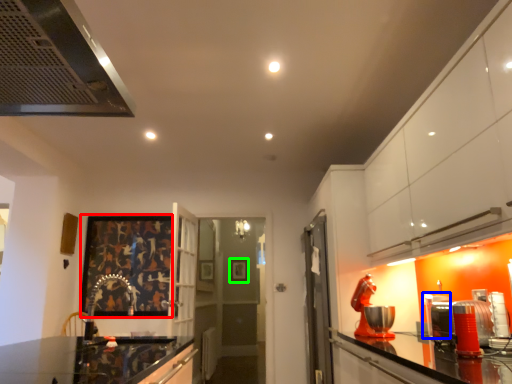
Question: Estimate the real-world distances between objects in this image. Which object is closer to picture frame (highlighted by a red box), appliance (highlighted by a blue box) or picture frame (highlighted by a green box)?

Choices:
 (A) appliance
 (B) picture frame

Answer: (B)